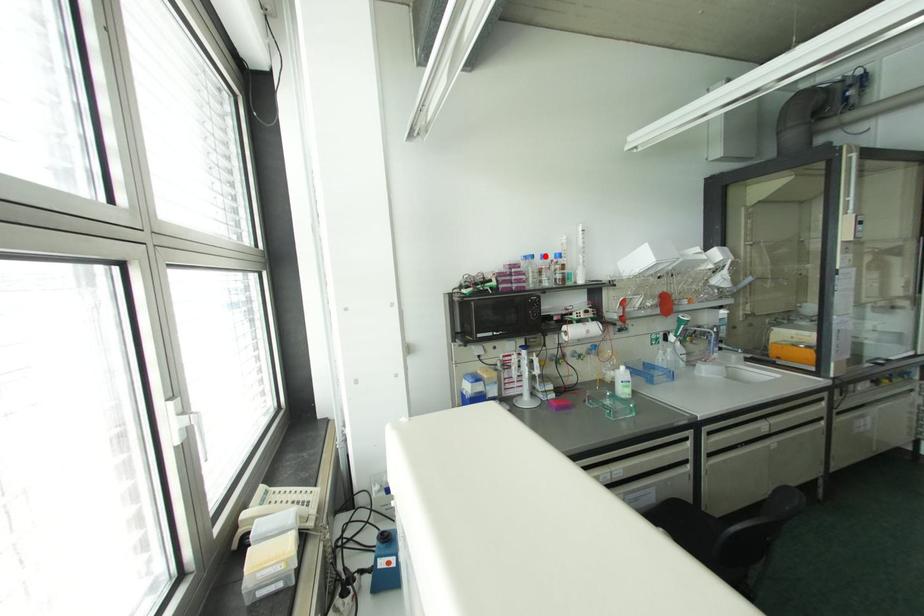
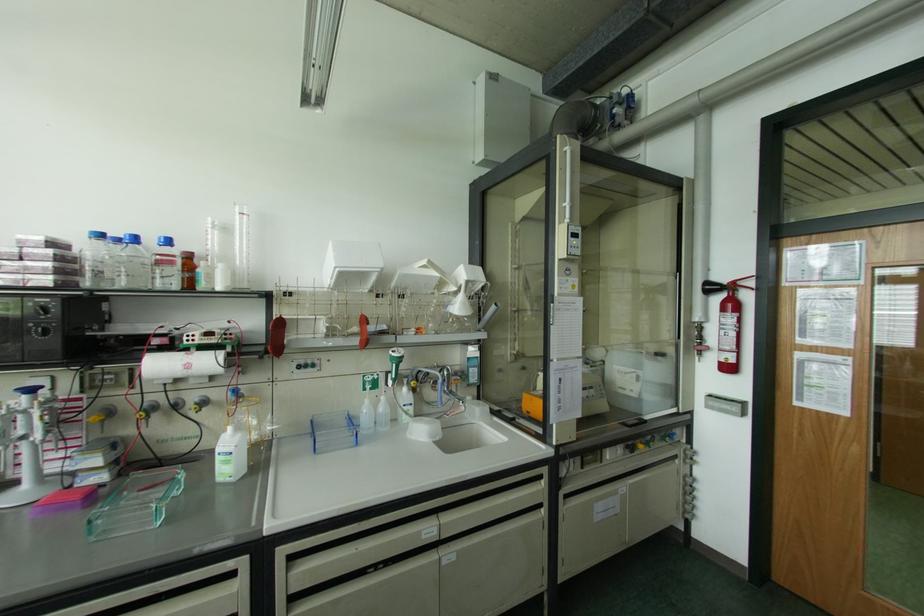
Locate, in the second image, the point that corresponds to the highlighted location in the first image.

(134, 238)